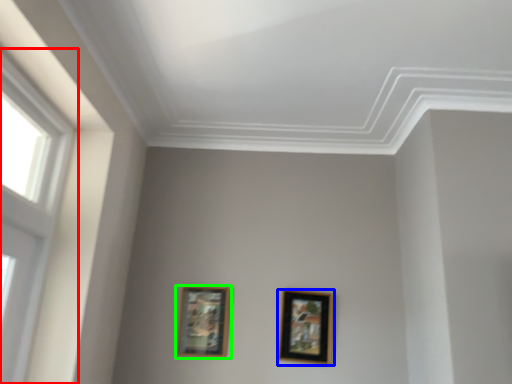
Question: Which is farther away from window (highlighted by a red box)? picture frame (highlighted by a blue box) or picture frame (highlighted by a green box)?

Choices:
 (A) picture frame
 (B) picture frame

Answer: (A)